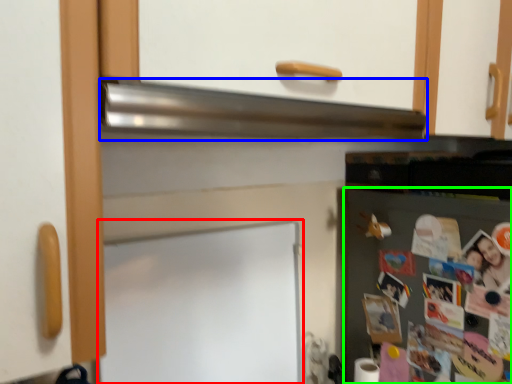
Question: Considering the real-world distances, which object is closest to bulletin board (highlighted by a red box)? exhaust hood (highlighted by a blue box) or fridge (highlighted by a green box).

Choices:
 (A) exhaust hood
 (B) fridge

Answer: (A)